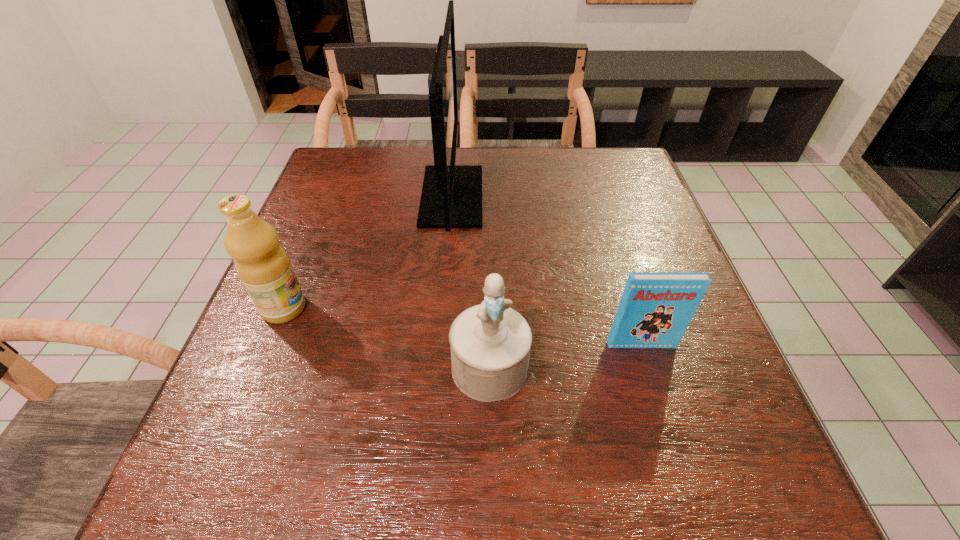
Identify the location of vacant area situated 0.160m on the front cover of the shortest object. (667, 430).

Locate an element on the screen. This screenshot has width=960, height=540. object situated at the far edge is located at coordinates (451, 197).

Where is `object that is at the left edge`? The width and height of the screenshot is (960, 540). object that is at the left edge is located at coordinates (262, 264).

What are the coordinates of `object that is at the right edge` in the screenshot? It's located at click(x=655, y=309).

Find the location of a particular element. This screenshot has height=540, width=960. free space at the far edge of the desktop is located at coordinates (504, 170).

At what (x,y) coordinates should I click in order to perform the action: click on vacant space at the near edge. Please return your answer as a coordinate pair (x, y). This screenshot has height=540, width=960. Looking at the image, I should click on (460, 468).

The width and height of the screenshot is (960, 540). Find the location of `vacant space at the left edge of the desktop`. vacant space at the left edge of the desktop is located at coordinates (300, 353).

The height and width of the screenshot is (540, 960). In the image, there is a desktop. Identify the location of blank space at the right edge. (606, 220).

Locate an element on the screen. vacant space at the far left corner of the desktop is located at coordinates (353, 168).

The width and height of the screenshot is (960, 540). What are the coordinates of `free spot at the far right corner of the desktop` in the screenshot? It's located at (599, 152).